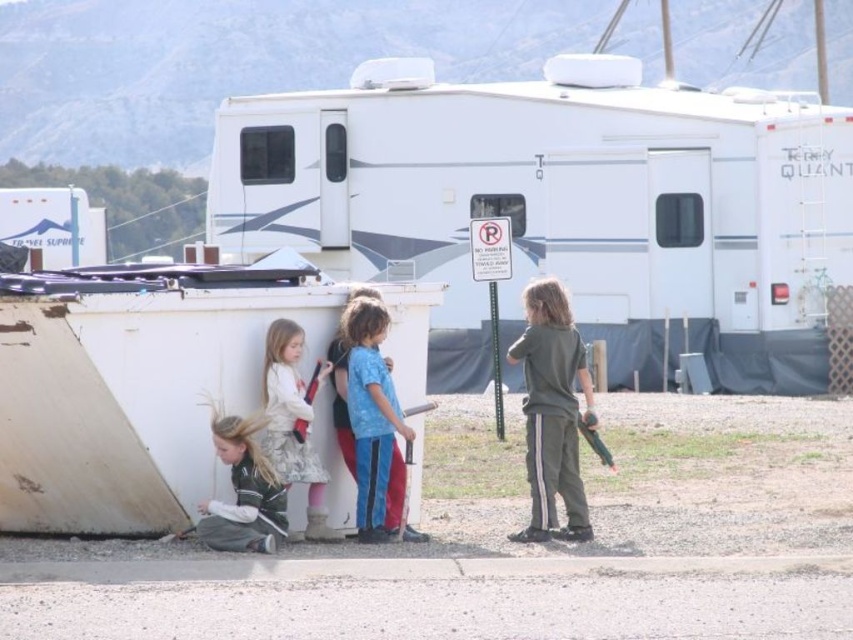
Which of these two, white plastic recreational vehicle at upper center or fluffy white coat at center, stands taller?

white plastic recreational vehicle at upper center

Is white plastic recreational vehicle at upper center above fluffy white coat at center?

Yes.

Where is `white plastic recreational vehicle at upper center`? This screenshot has width=853, height=640. white plastic recreational vehicle at upper center is located at coordinates (560, 196).

Can you confirm if white plastic recreational vehicle at upper center is positioned to the right of green matte pants at right?

Indeed, white plastic recreational vehicle at upper center is positioned on the right side of green matte pants at right.

Is point (363, 74) closer to viewer compared to point (537, 403)?

No.

Image resolution: width=853 pixels, height=640 pixels. Identify the location of white plastic recreational vehicle at upper center. (560, 196).

Does blue cotton shirt at center have a larger size compared to green fabric jacket at lower left?

Indeed, blue cotton shirt at center has a larger size compared to green fabric jacket at lower left.

Find the location of `blue cotton shirt at center`. blue cotton shirt at center is located at coordinates (370, 413).

The image size is (853, 640). What are the coordinates of `blue cotton shirt at center` in the screenshot? It's located at (370, 413).